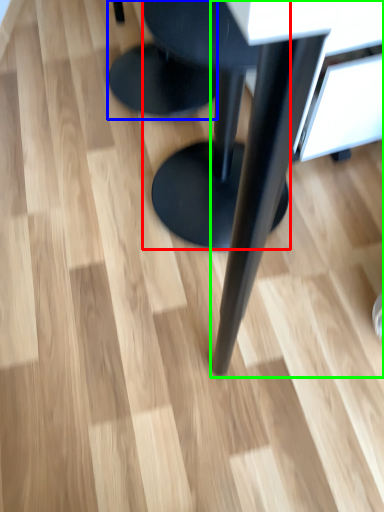
Question: Based on their relative distances, which object is nearer to stool (highlighted by a red box)? Choose from stool (highlighted by a blue box) and table (highlighted by a green box).

Choices:
 (A) stool
 (B) table

Answer: (B)